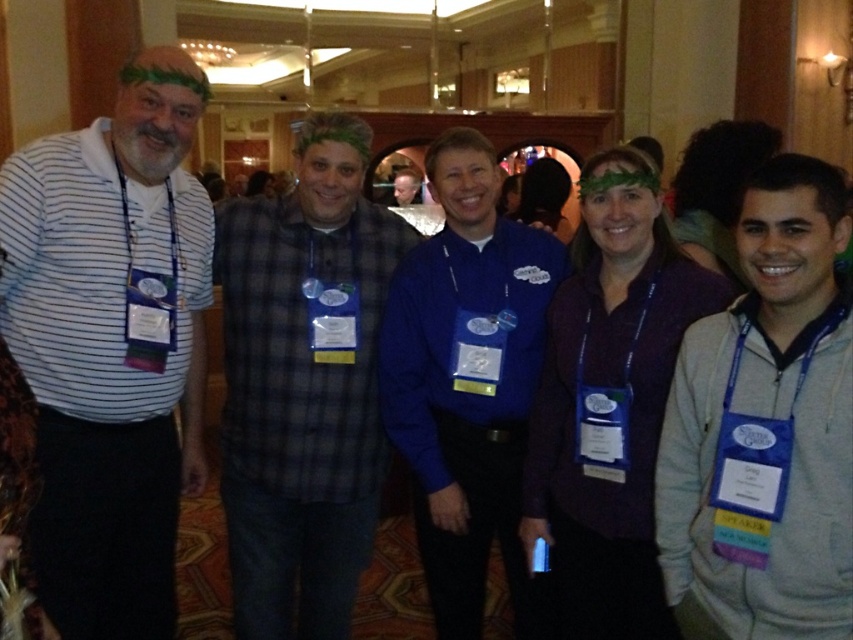
Who is shorter, plaid shirt at center or matte blue shirt at center?

matte blue shirt at center is shorter.

Between point (363, 444) and point (401, 204), which one is positioned in front?

Point (363, 444)

Locate an element on the screen. The image size is (853, 640). plaid shirt at center is located at coordinates (305, 384).

Based on the photo, does white striped shirt at left lie behind blue fabric shirt at center?

No, white striped shirt at left is closer to the viewer.

What do you see at coordinates (111, 344) in the screenshot? I see `white striped shirt at left` at bounding box center [111, 344].

Who is more forward, (97, 170) or (503, 436)?

Point (97, 170) is in front.

This screenshot has height=640, width=853. Identify the location of white striped shirt at left. (111, 344).

Can you confirm if plaid shirt at center is positioned above blue fabric shirt at center?

Indeed, plaid shirt at center is positioned over blue fabric shirt at center.

Can you confirm if plaid shirt at center is wider than blue fabric shirt at center?

Indeed, plaid shirt at center has a greater width compared to blue fabric shirt at center.

The image size is (853, 640). What do you see at coordinates (305, 384) in the screenshot?
I see `plaid shirt at center` at bounding box center [305, 384].

You are a GUI agent. You are given a task and a screenshot of the screen. Output one action in this format:
    pyautogui.click(x=<x>, y=<y>)
    Task: Click on the plaid shirt at center
    
    Given the screenshot: What is the action you would take?
    pyautogui.click(x=305, y=384)